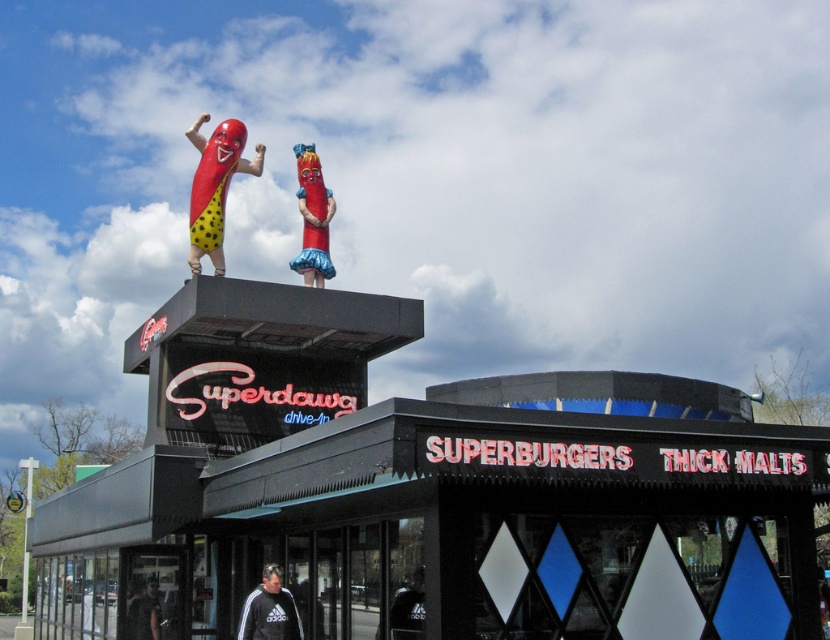
Is black matte sign at upper center further to the viewer compared to dark gray hoodie at lower left?

No, black matte sign at upper center is in front of dark gray hoodie at lower left.

Is black matte sign at upper center positioned before dark gray hoodie at lower left?

Yes.

The height and width of the screenshot is (640, 830). I want to click on black matte sign at upper center, so click(x=427, y=492).

Which is below, polka dot rubber hot dog at upper center or dark gray hoodie at lower left?

dark gray hoodie at lower left

Where is `polka dot rubber hot dog at upper center`? polka dot rubber hot dog at upper center is located at coordinates (215, 186).

Image resolution: width=830 pixels, height=640 pixels. What are the coordinates of `polka dot rubber hot dog at upper center` in the screenshot? It's located at (215, 186).

Is point (715, 432) more distant than point (249, 628)?

No, it is not.

Who is shorter, black matte sign at upper center or black cotton sweatshirt at lower center?

black cotton sweatshirt at lower center

This screenshot has width=830, height=640. What do you see at coordinates (427, 492) in the screenshot?
I see `black matte sign at upper center` at bounding box center [427, 492].

Locate an element on the screen. black matte sign at upper center is located at coordinates (427, 492).